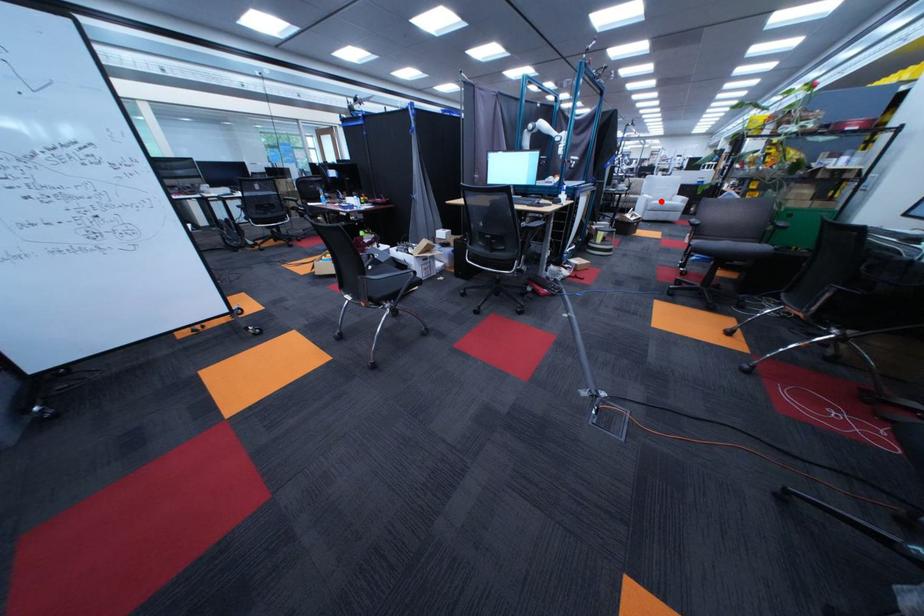
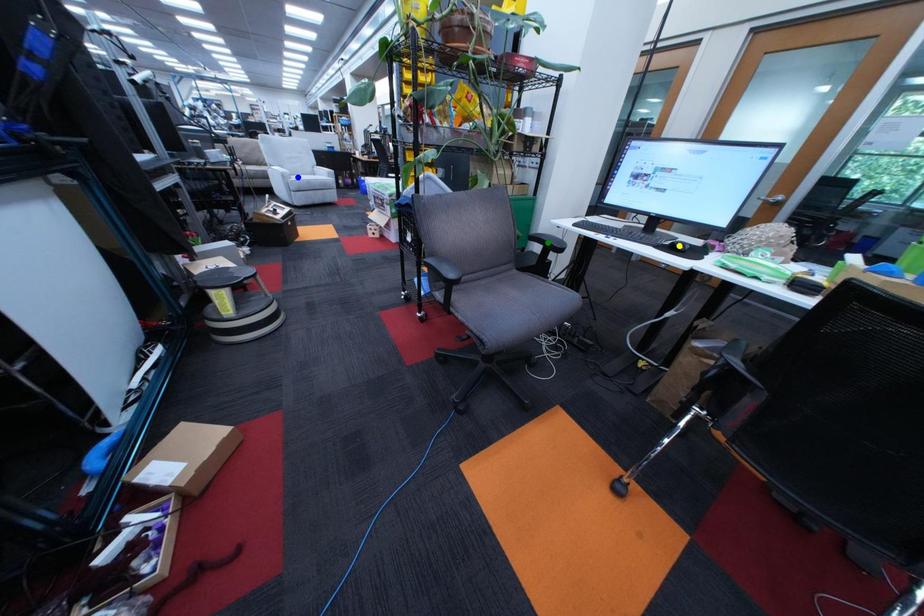
Question: I am providing you with two images of the same scene from different viewpoints. A red point is marked on the first image. You are given multiple points on the second image. In image 2, which mark is for the same physical point as the one in image 1?

Choices:
 (A) yellow point
 (B) blue point
 (C) green point

Answer: (B)